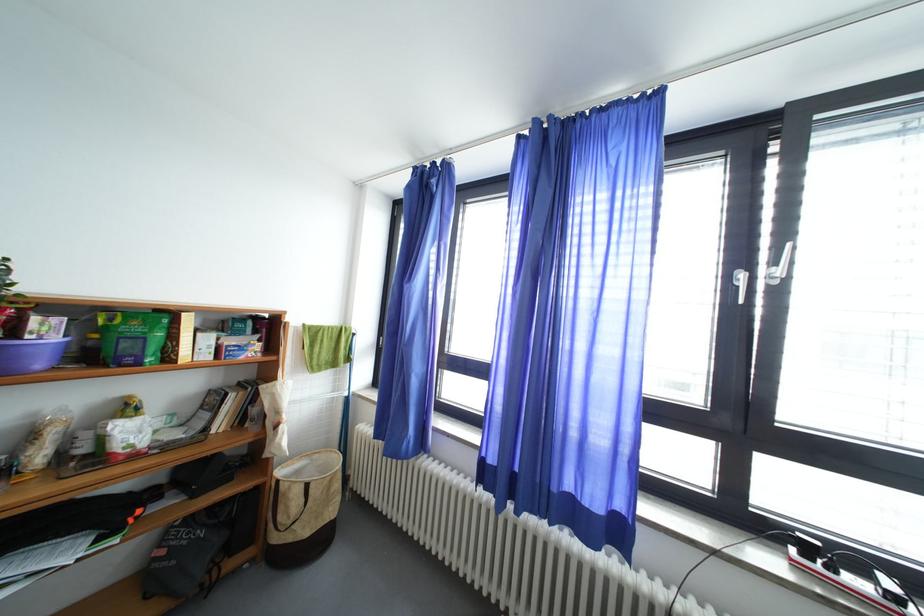
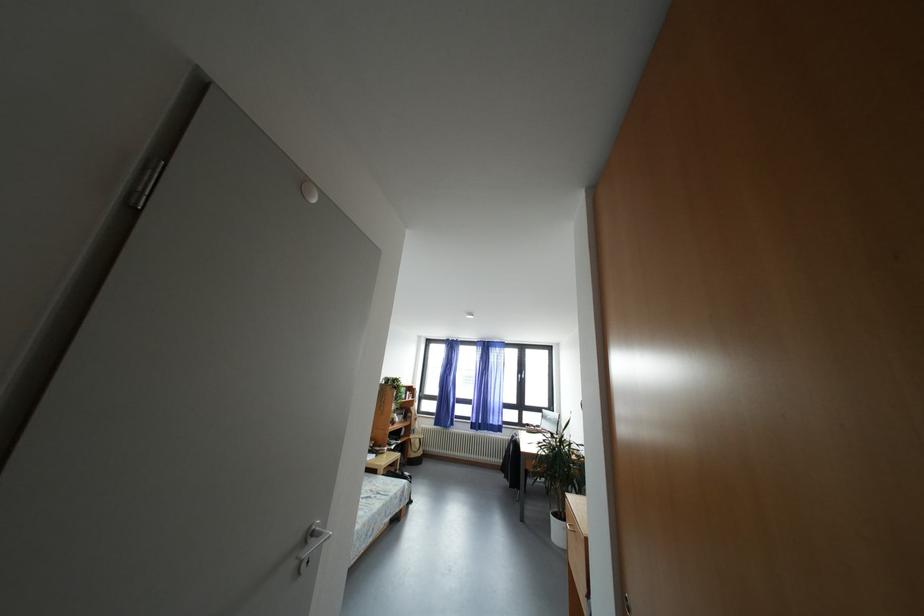
Find the pixel in the second image that matches [813,553] in the first image.

(533, 430)